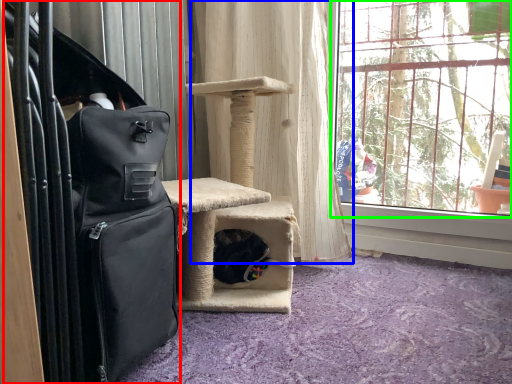
Question: Considering the real-world distances, which object is farthest from luggage (highlighted by a red box)? curtain (highlighted by a blue box) or window (highlighted by a green box)?

Choices:
 (A) curtain
 (B) window

Answer: (B)